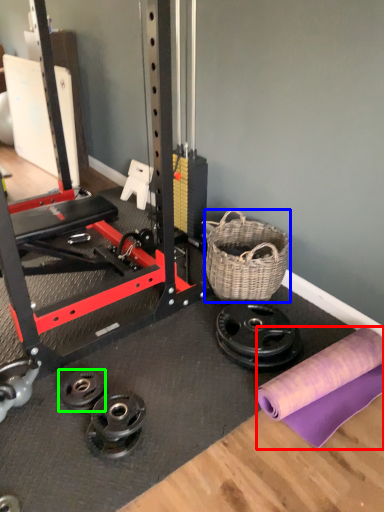
Question: Which object is the closest to the fabric (highlighted by a red box)? Choose among these: basket (highlighted by a blue box) or wheel (highlighted by a green box).

Choices:
 (A) basket
 (B) wheel

Answer: (A)